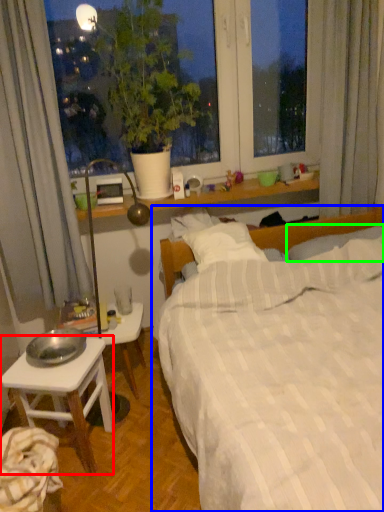
Question: Based on their relative distances, which object is farther from desk (highlighted by a red box)? Choose from bed (highlighted by a blue box) and pillow (highlighted by a green box).

Choices:
 (A) bed
 (B) pillow

Answer: (B)